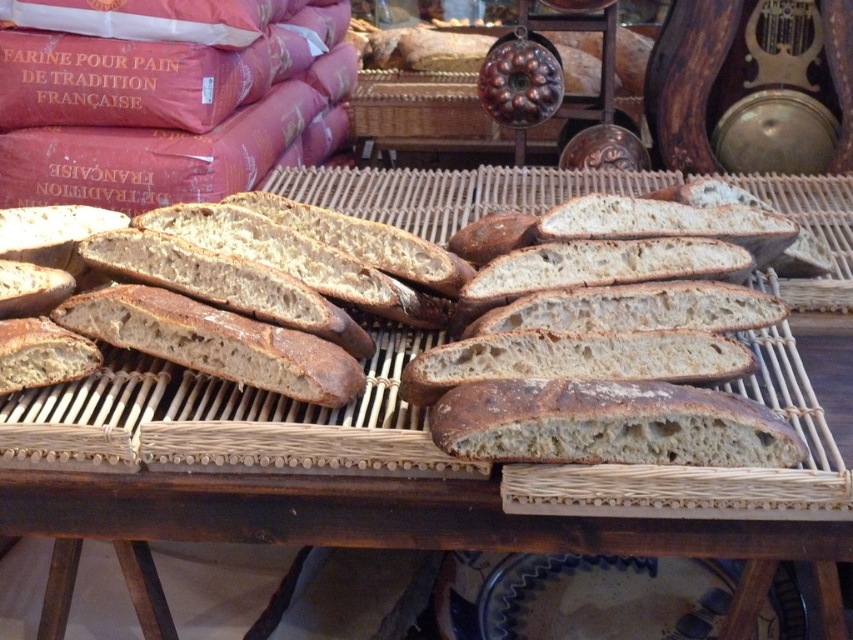
You are a baker inspecting the display of bread. You need to retrieve the brown crusty loaf of bread at center. Can you reach it without moving the brown matte baguette at center?

The brown crusty loaf of bread at center is behind the brown matte baguette at center, so you can reach it without moving the brown matte baguette at center by accessing it from the back side.

You are a baker who wants to place a small sticker on the brown matte baguette at center. The sticker is 0.05 units wide. If you want to place it at the point with coordinates (223, 420), will it fit without overlapping other parts of the baguette?

The point (223, 420) is on the brown matte baguette at center, so placing the sticker there will not overlap other parts of the baguette as it is within the baguette itself.